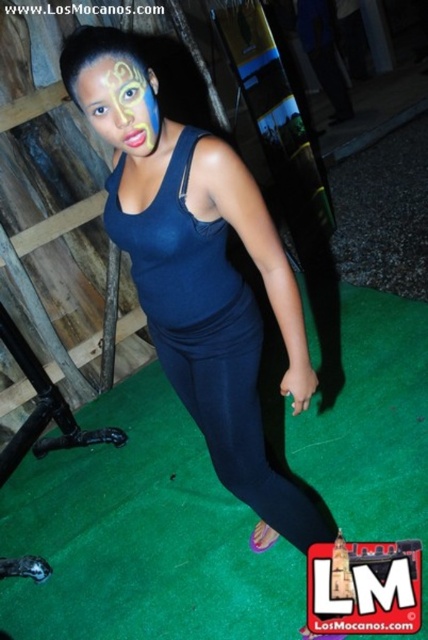
You are a fashion designer analyzing the image. You need to determine which item, the matte blue tank top at center or the yellow matte face paint at center, has a greater horizontal span. Based on the scene, which one is wider?

The matte blue tank top at center has a greater width than the yellow matte face paint at center, so the matte blue tank top at center is wider.

You are an artist observing the scene. You need to paint a portrait of the person in the image. Which object is positioned to the right of the other between the matte blue tank top at center and the yellow matte face paint at center?

The matte blue tank top at center is positioned to the right of the yellow matte face paint at center.